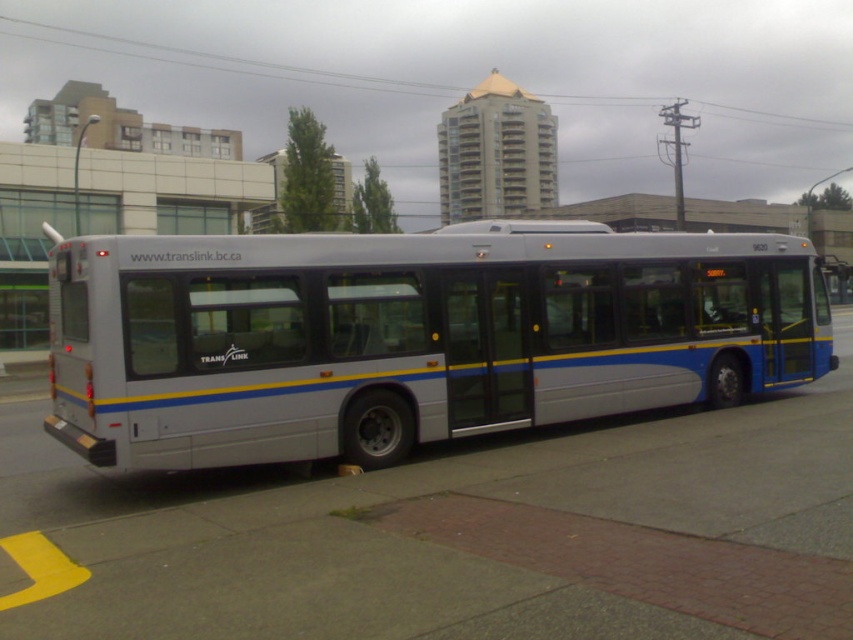
You are a delivery person trying to park your van next to the gray concrete pavement at center and the silver metallic bus at center. Based on their sizes, which object should you avoid parking too close to?

The gray concrete pavement at center has a smaller size compared to the silver metallic bus at center, so you should avoid parking too close to the silver metallic bus at center as it is larger and may obstruct your van.

You are standing on the sidewalk in front of the bus and want to know which of the two points, point (360, 481) or point (126, 259), is closer to you. Based on their positions, which point is nearer?

Point (360, 481) is further to the viewer than point (126, 259), so the point closer to you is point (126, 259).